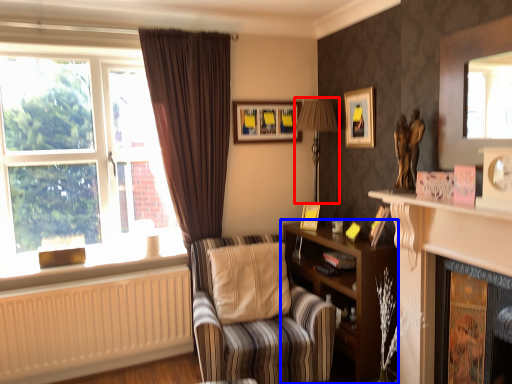
Question: Which of the following is the farthest to the observer, table lamp (highlighted by a red box) or shelf (highlighted by a blue box)?

Choices:
 (A) table lamp
 (B) shelf

Answer: (A)